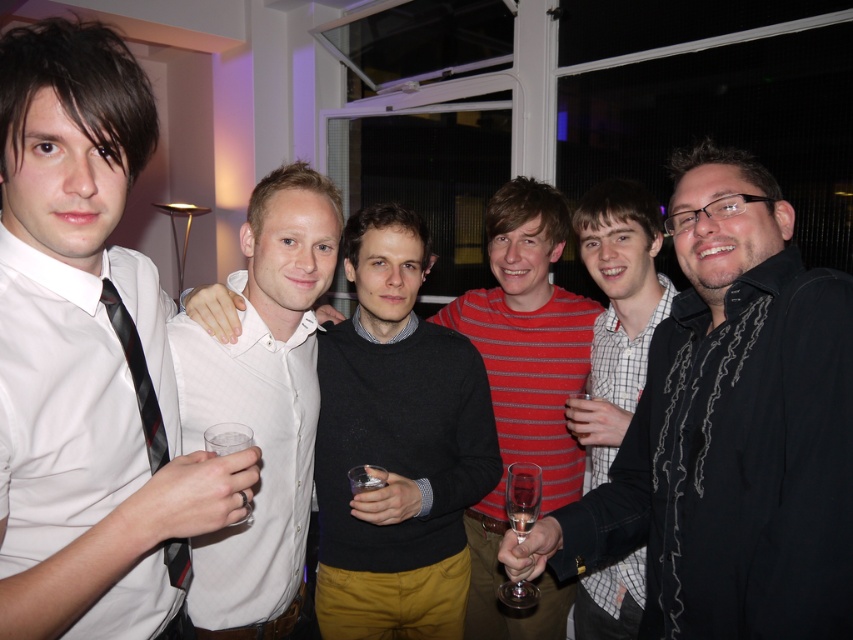
Is white shirt at center to the left of striped cotton shirt at center from the viewer's perspective?

Yes, white shirt at center is to the left of striped cotton shirt at center.

Does white shirt at center have a greater height compared to striped cotton shirt at center?

No.

Measure the distance between point (201, 573) and camera.

Point (201, 573) is 1.28 meters away from camera.

Where is `white shirt at center`? The height and width of the screenshot is (640, 853). white shirt at center is located at coordinates (260, 397).

Is black textured shirt at center further to the viewer compared to striped cotton shirt at center?

No, it is not.

Is black textured shirt at center positioned before striped cotton shirt at center?

Yes, black textured shirt at center is in front of striped cotton shirt at center.

What do you see at coordinates (729, 429) in the screenshot? I see `black textured shirt at center` at bounding box center [729, 429].

Where is `black textured shirt at center`? The height and width of the screenshot is (640, 853). black textured shirt at center is located at coordinates (729, 429).

Is point (653, 369) closer to viewer compared to point (293, 378)?

Yes, point (653, 369) is in front of point (293, 378).

Does black textured shirt at center appear over white shirt at center?

Yes.

Image resolution: width=853 pixels, height=640 pixels. What do you see at coordinates (729, 429) in the screenshot?
I see `black textured shirt at center` at bounding box center [729, 429].

Where is `black textured shirt at center`? The height and width of the screenshot is (640, 853). black textured shirt at center is located at coordinates (729, 429).